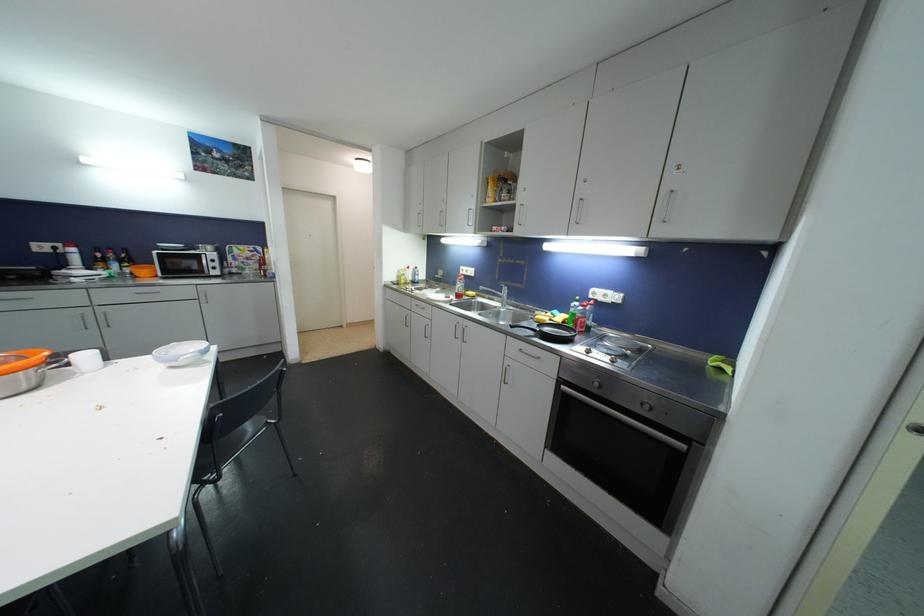
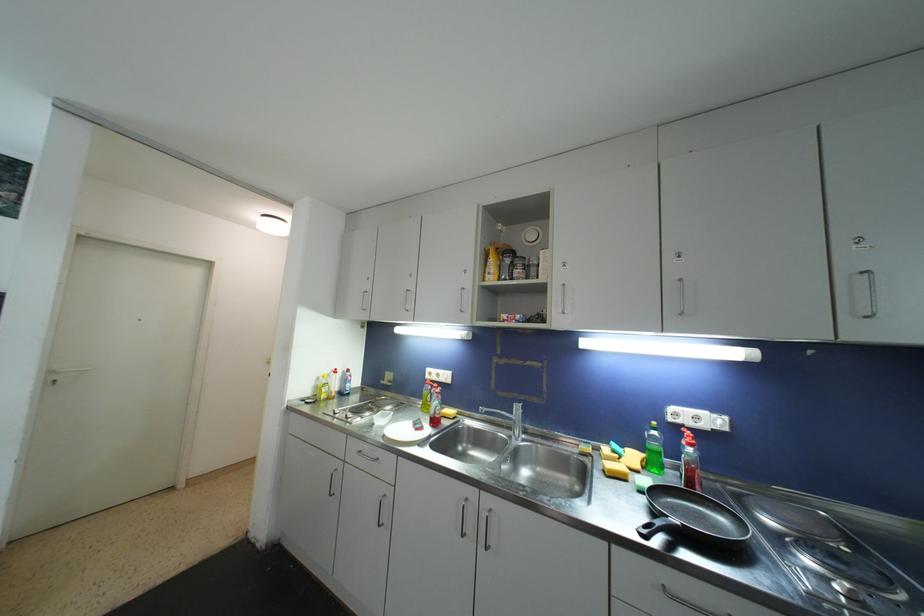
Where in the second image is the point corresponding to [402,280] from the first image?

(321, 391)